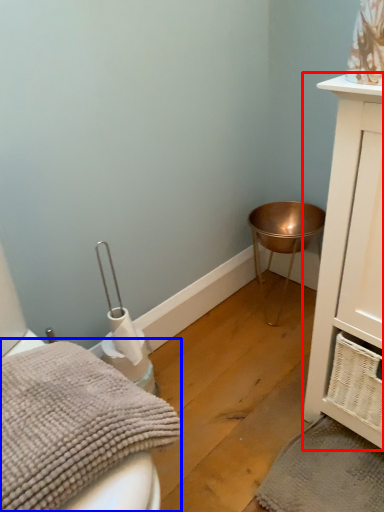
Question: Which object is further to the camera taking this photo, bathroom cabinet (highlighted by a red box) or bath towel (highlighted by a blue box)?

Choices:
 (A) bathroom cabinet
 (B) bath towel

Answer: (A)